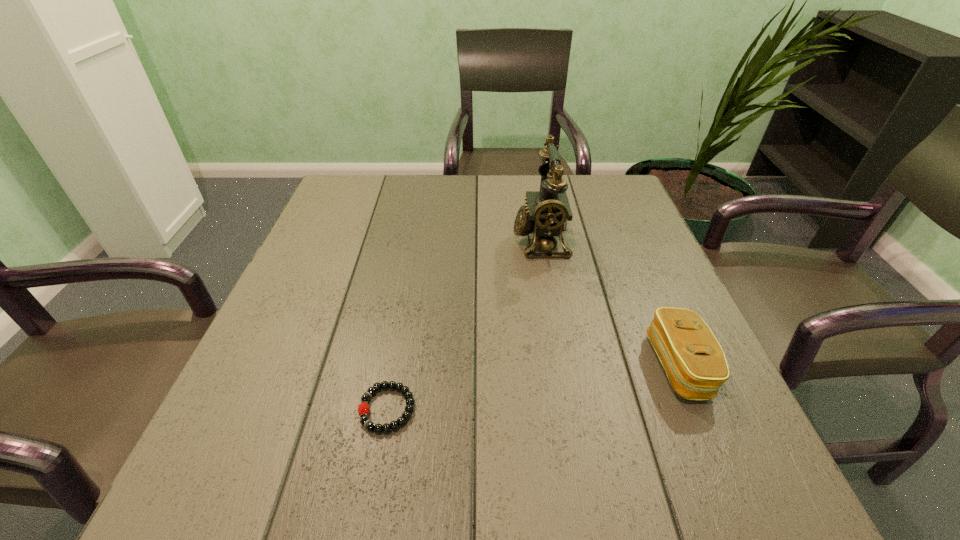
Locate an element on the screen. vacant area at the far right corner of the desktop is located at coordinates (576, 203).

At what (x,y) coordinates should I click in order to perform the action: click on free spot between the farthest object and the second tallest object. Please return your answer as a coordinate pair (x, y). The image size is (960, 540). Looking at the image, I should click on (610, 303).

Identify the location of vacant area between the shortest object and the second shortest object. This screenshot has width=960, height=540. (533, 388).

The image size is (960, 540). Identify the location of free space between the clutch bag and the telephone. (610, 303).

Find the location of a particular element. free space between the second shortest object and the telephone is located at coordinates (610, 303).

This screenshot has width=960, height=540. I want to click on free space that is in between the second shortest object and the tallest object, so click(610, 303).

Find the location of a particular element. free spot between the farthest object and the bracelet is located at coordinates (464, 325).

Where is `vacant point located between the rightmost object and the farthest object`? This screenshot has width=960, height=540. vacant point located between the rightmost object and the farthest object is located at coordinates (610, 303).

You are a GUI agent. You are given a task and a screenshot of the screen. Output one action in this format:
    pyautogui.click(x=<x>, y=<y>)
    Task: Click on the vacant space that is in between the second shortest object and the leftmost object
    This screenshot has height=540, width=960.
    Given the screenshot: What is the action you would take?
    pyautogui.click(x=533, y=388)

The height and width of the screenshot is (540, 960). What are the coordinates of `free area in between the farthest object and the leftmost object` in the screenshot? It's located at (464, 325).